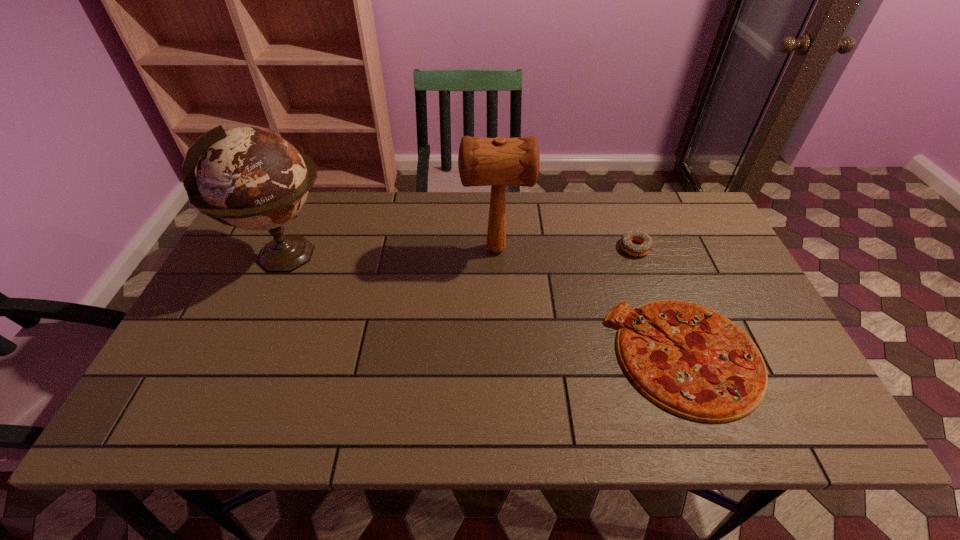
Find the location of a particular element. The width and height of the screenshot is (960, 540). free space located 0.300m on the front of the third tallest object is located at coordinates (670, 345).

This screenshot has height=540, width=960. I want to click on free space located 0.250m on the left of the shortest object, so click(505, 356).

Locate an element on the screen. Image resolution: width=960 pixels, height=540 pixels. globe that is at the far edge is located at coordinates (251, 178).

This screenshot has width=960, height=540. In order to click on mallet situated at the far edge in this screenshot , I will do `click(496, 162)`.

This screenshot has width=960, height=540. I want to click on doughnut situated at the far edge, so point(645,240).

Find the location of a particular element. object present at the near edge is located at coordinates (717, 374).

Identify the location of object located in the left edge section of the desktop. (251, 178).

You are a GUI agent. You are given a task and a screenshot of the screen. Output one action in this format:
    pyautogui.click(x=<x>, y=<y>)
    Task: Click on the object that is at the right edge
    This screenshot has height=540, width=960.
    Given the screenshot: What is the action you would take?
    pyautogui.click(x=717, y=374)

Find the location of a particular element. The height and width of the screenshot is (540, 960). object that is positioned at the far left corner is located at coordinates (251, 178).

Identify the location of object located in the near right corner section of the desktop. This screenshot has width=960, height=540. (717, 374).